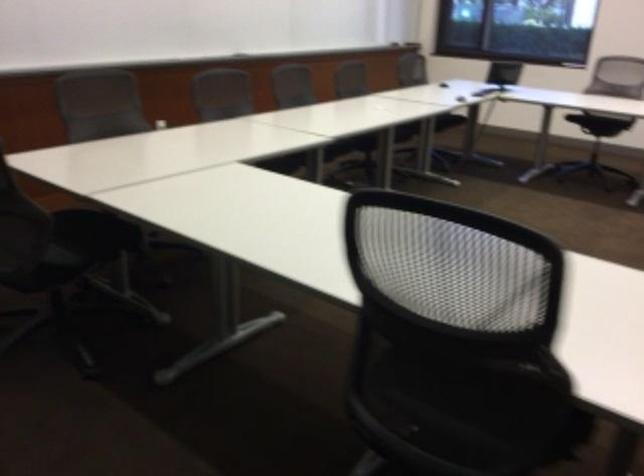
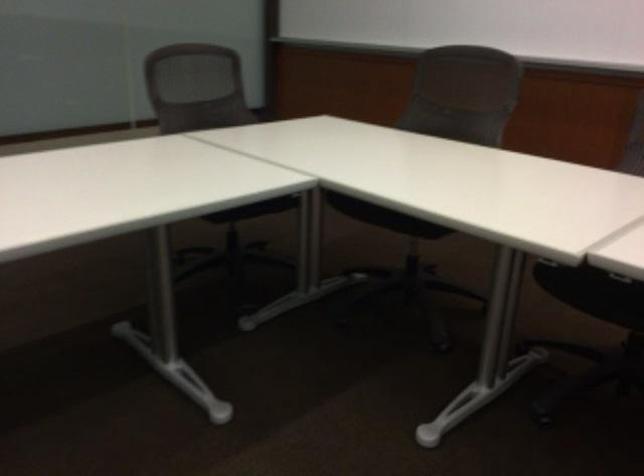
In the second image, find the point that corresponds to (x=279, y=172) in the first image.

(592, 292)